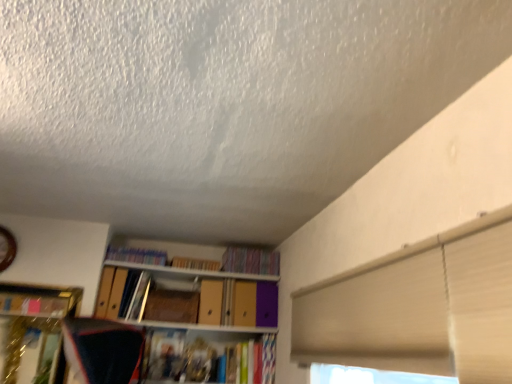
Question: Is matte cardboard book at upper center, positioned as the 2th book in left-to-right order, at the right side of wooden paperback book at center?

Choices:
 (A) yes
 (B) no

Answer: (A)

Question: Does matte cardboard book at upper center, arranged as the 2th book when viewed from the right, appear on the left side of wooden paperback book at center?

Choices:
 (A) yes
 (B) no

Answer: (B)

Question: Can wooden paperback book at center be found inside matte cardboard book at upper center, arranged as the 2th book when viewed from the right?

Choices:
 (A) no
 (B) yes

Answer: (A)

Question: Is matte cardboard book at upper center, positioned as the 2th book in left-to-right order, not near wooden paperback book at center?

Choices:
 (A) yes
 (B) no

Answer: (B)

Question: Can you confirm if matte cardboard book at upper center, positioned as the 2th book in left-to-right order, is thinner than wooden paperback book at center?

Choices:
 (A) no
 (B) yes

Answer: (B)

Question: Is matte cardboard book at upper center, arranged as the 2th book when viewed from the right, oriented towards wooden paperback book at center?

Choices:
 (A) no
 (B) yes

Answer: (A)

Question: Considering the relative sizes of matte cardboard book at upper center, arranged as the 2th book when viewed from the right, and matte plastic books at upper center, arranged as the 1th book when viewed from the left, in the image provided, is matte cardboard book at upper center, arranged as the 2th book when viewed from the right, bigger than matte plastic books at upper center, arranged as the 1th book when viewed from the left,?

Choices:
 (A) yes
 (B) no

Answer: (B)

Question: Are matte cardboard book at upper center, positioned as the 2th book in left-to-right order, and matte plastic books at upper center, arranged as the 3th book when viewed from the right, located far from each other?

Choices:
 (A) no
 (B) yes

Answer: (A)

Question: Are matte cardboard book at upper center, arranged as the 2th book when viewed from the right, and matte plastic books at upper center, arranged as the 3th book when viewed from the right, making contact?

Choices:
 (A) no
 (B) yes

Answer: (A)

Question: Considering the relative sizes of matte cardboard book at upper center, positioned as the 2th book in left-to-right order, and matte plastic books at upper center, arranged as the 1th book when viewed from the left, in the image provided, is matte cardboard book at upper center, positioned as the 2th book in left-to-right order, thinner than matte plastic books at upper center, arranged as the 1th book when viewed from the left,?

Choices:
 (A) no
 (B) yes

Answer: (A)

Question: Can you confirm if matte cardboard book at upper center, positioned as the 2th book in left-to-right order, is shorter than matte plastic books at upper center, arranged as the 3th book when viewed from the right?

Choices:
 (A) yes
 (B) no

Answer: (A)

Question: Is matte cardboard book at upper center, arranged as the 2th book when viewed from the right, at the right side of matte plastic books at upper center, arranged as the 1th book when viewed from the left?

Choices:
 (A) no
 (B) yes

Answer: (B)

Question: Is matte plastic books at upper center, arranged as the 3th book when viewed from the right, positioned before multicolored fabric book at upper center, marked as the 1th book in a right-to-left arrangement?

Choices:
 (A) yes
 (B) no

Answer: (A)